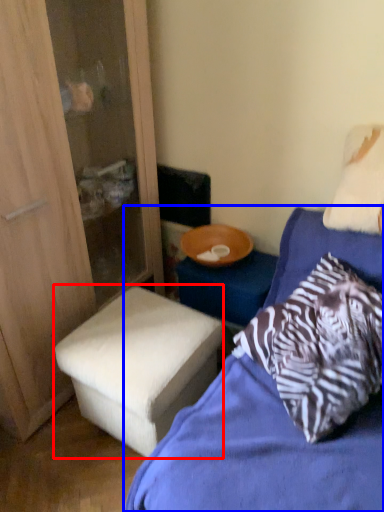
Question: Among these objects, which one is farthest to the camera, stool (highlighted by a red box) or bed (highlighted by a blue box)?

Choices:
 (A) stool
 (B) bed

Answer: (A)